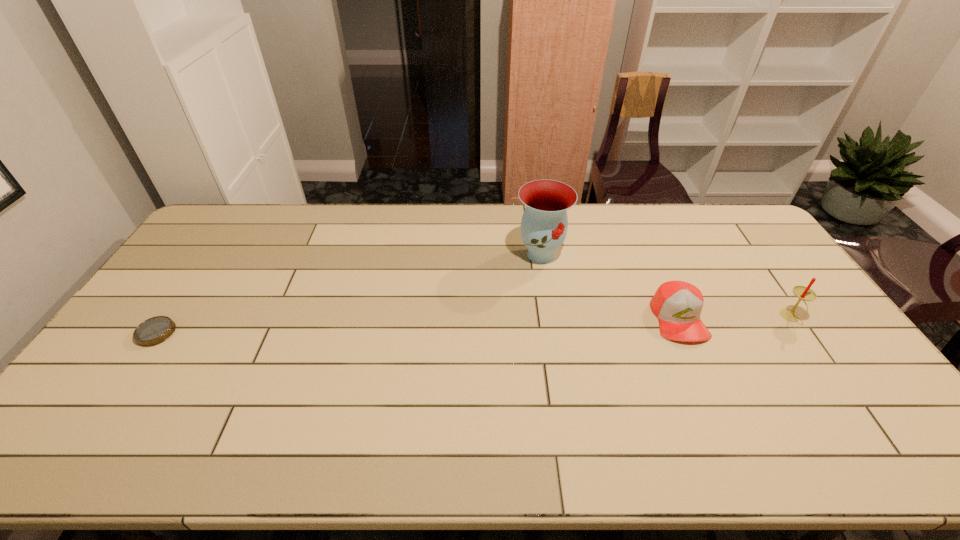
The image size is (960, 540). Find the location of `vacant space located on the front-facing side of the second shortest object`. vacant space located on the front-facing side of the second shortest object is located at coordinates (712, 396).

Where is `free space located 0.200m on the front of the leftmost object`? The height and width of the screenshot is (540, 960). free space located 0.200m on the front of the leftmost object is located at coordinates (102, 412).

Identify the location of object present at the far edge. (544, 224).

This screenshot has width=960, height=540. I want to click on object situated at the left edge, so click(153, 331).

What are the coordinates of `object at the right edge` in the screenshot? It's located at (x=803, y=293).

At what (x,y) coordinates should I click in order to perform the action: click on free space at the far edge of the desktop. Please return your answer as a coordinate pair (x, y). Looking at the image, I should click on (412, 215).

Locate an element on the screen. vacant space at the near edge of the desktop is located at coordinates (626, 433).

Find the location of a particular element. vacant area at the right edge is located at coordinates pos(810,302).

The image size is (960, 540). What are the coordinates of `vacant space at the far left corner of the desktop` in the screenshot? It's located at (219, 238).

Find the location of a particular element. The width and height of the screenshot is (960, 540). vacant region between the second shortest object and the rightmost object is located at coordinates (734, 318).